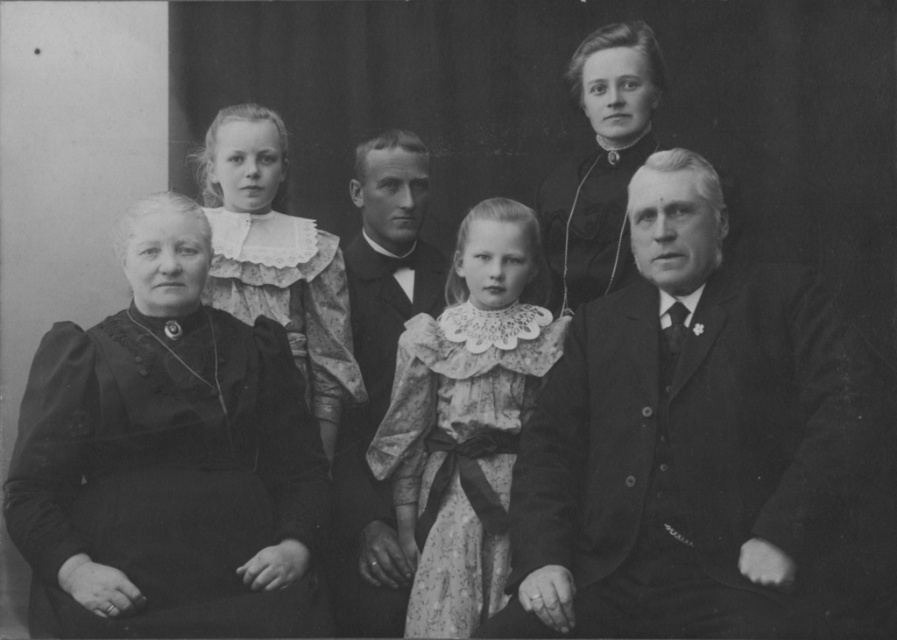
Question: Is smooth black suit at right to the right of black velvet dress at left from the viewer's perspective?

Choices:
 (A) yes
 (B) no

Answer: (A)

Question: Estimate the real-world distances between objects in this image. Which object is closer to the smooth black suit at center?

Choices:
 (A) black velvet dress at left
 (B) floral lace dress at center
 (C) smooth black suit at right
 (D) matte black dress at upper center

Answer: (B)

Question: Which object is the closest to the matte black dress at upper center?

Choices:
 (A) smooth black suit at right
 (B) floral lace dress at center
 (C) smooth black suit at center

Answer: (B)

Question: Is smooth black suit at right above black velvet dress at left?

Choices:
 (A) no
 (B) yes

Answer: (B)

Question: Is smooth black suit at right wider than black velvet dress at left?

Choices:
 (A) yes
 (B) no

Answer: (A)

Question: Among these objects, which one is nearest to the camera?

Choices:
 (A) smooth black suit at center
 (B) smooth black suit at right
 (C) matte black dress at upper center
 (D) floral lace dress at center

Answer: (B)